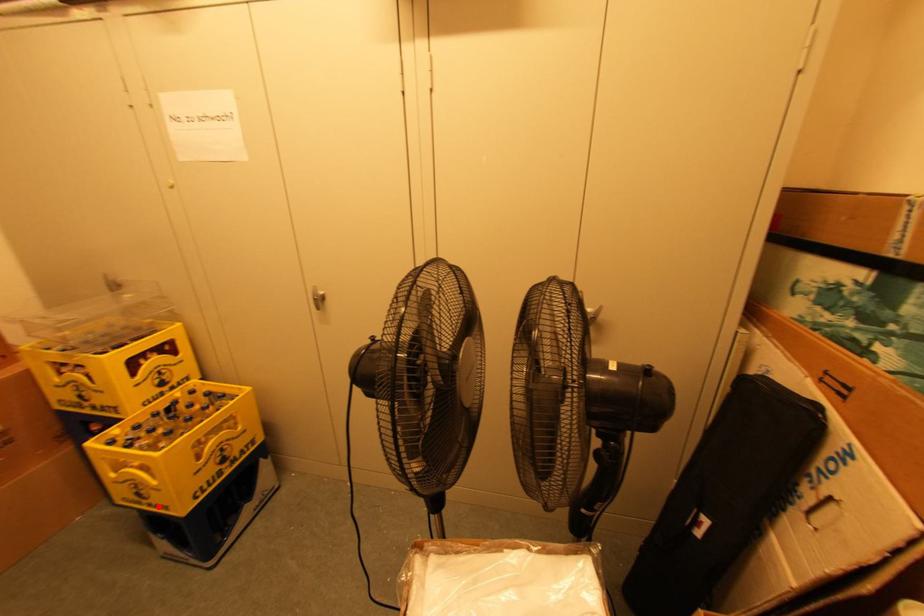
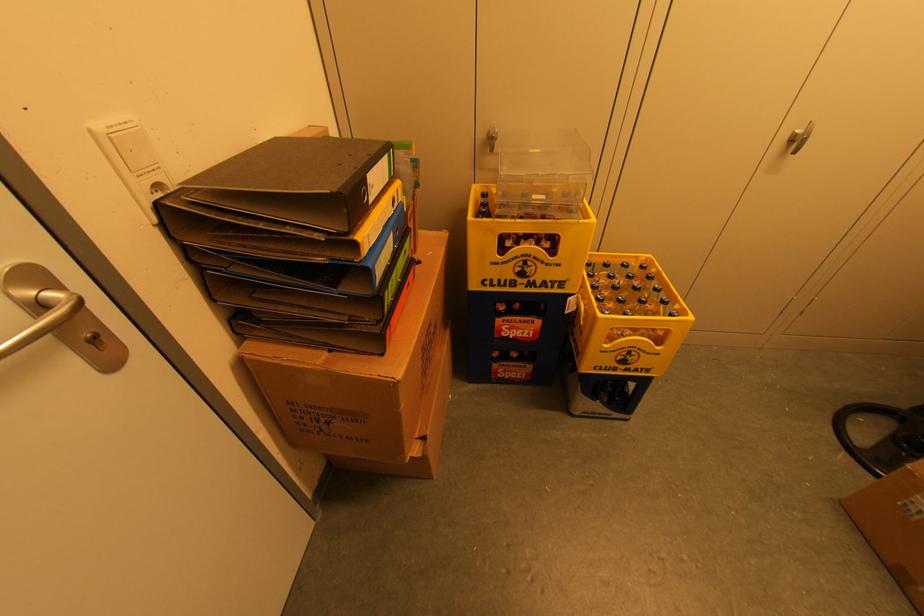
The point at the highlighted location is marked in the first image. Where is the corresponding point in the second image?

(638, 370)